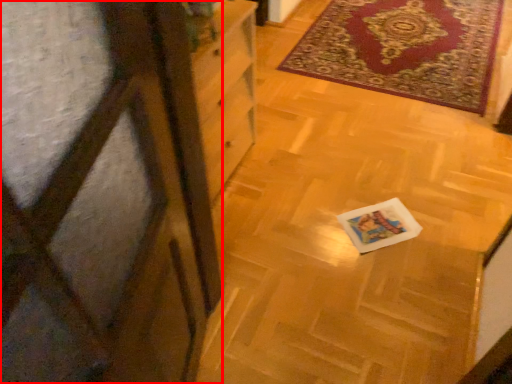
Question: From the image's perspective, where is screen door (annotated by the red box) located relative to mat?

Choices:
 (A) above
 (B) below

Answer: (B)